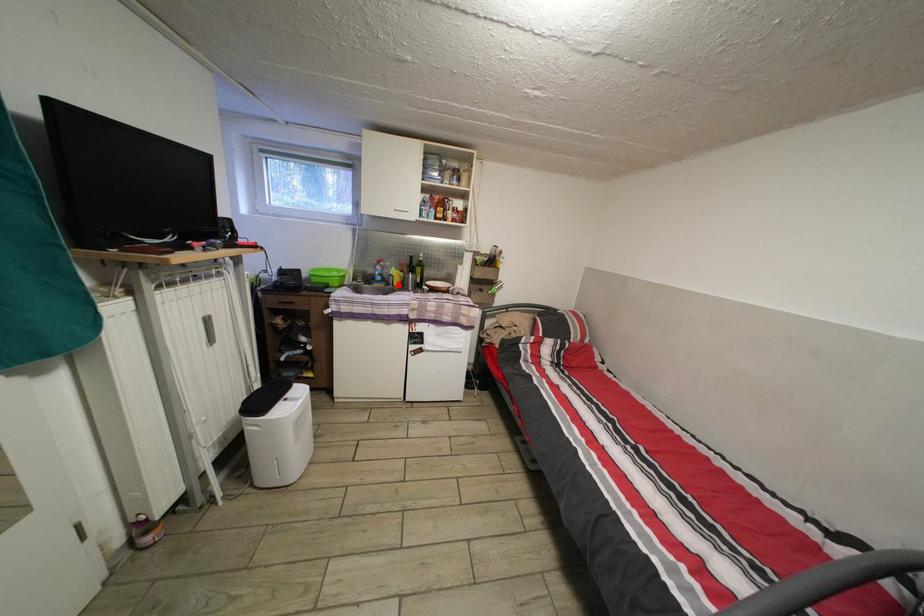
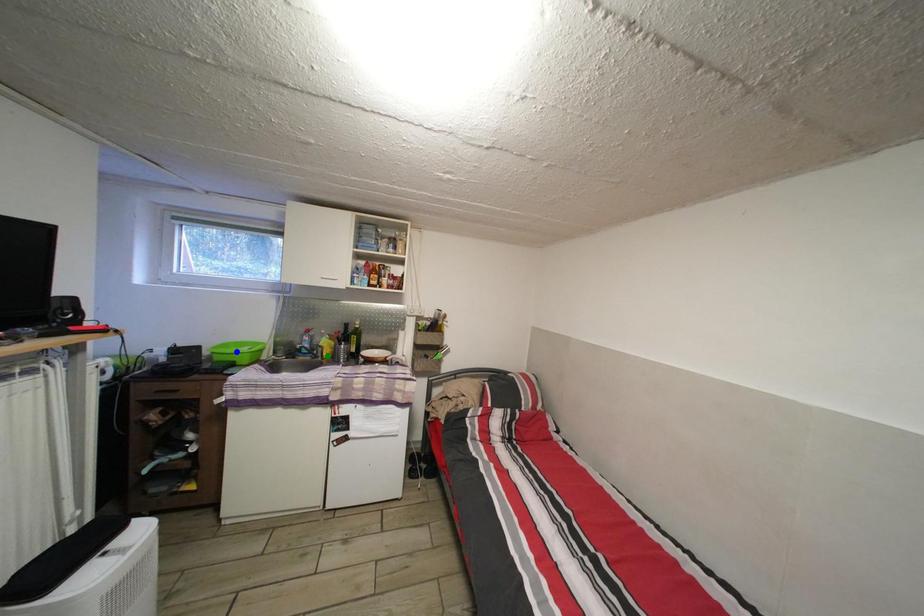
Question: I am providing you with two images of the same scene from different viewpoints. A red point is marked on the first image. You are given multiple points on the second image. Which spot in image 2 lines up with the point in image 1?

Choices:
 (A) yellow point
 (B) blue point
 (C) green point

Answer: (C)